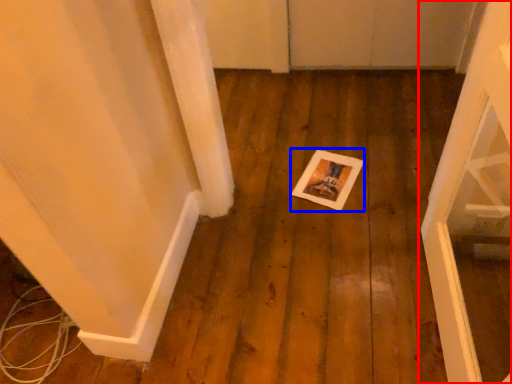
Question: Among these objects, which one is nearest to the camera, door (highlighted by a red box) or postcard (highlighted by a blue box)?

Choices:
 (A) door
 (B) postcard

Answer: (A)